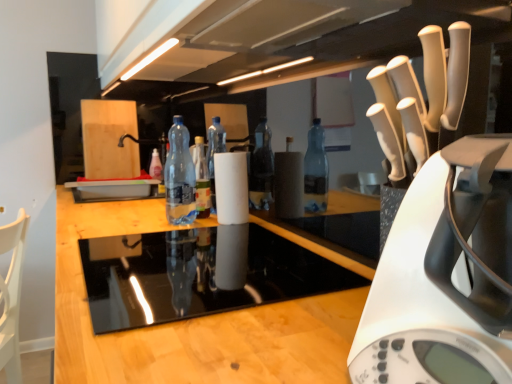
Question: Which direction should I rotate to look at translucent plastic bottle at center, the first bottle viewed from the left, — up or down?

Choices:
 (A) down
 (B) up

Answer: (B)

Question: Is the depth of white plastic kettle at right less than that of transparent plastic bottle at center, the 1th bottle when ordered from front to back?

Choices:
 (A) yes
 (B) no

Answer: (A)

Question: Is white plastic kettle at right not within transparent plastic bottle at center, which is the 1th bottle in right-to-left order?

Choices:
 (A) no
 (B) yes

Answer: (B)

Question: Considering the relative positions of white plastic kettle at right and transparent plastic bottle at center, which is the 1th bottle in right-to-left order, in the image provided, is white plastic kettle at right to the left of transparent plastic bottle at center, which is the 1th bottle in right-to-left order, from the viewer's perspective?

Choices:
 (A) no
 (B) yes

Answer: (A)

Question: Considering the relative positions of white plastic kettle at right and transparent plastic bottle at center, arranged as the second bottle when viewed from the left, in the image provided, is white plastic kettle at right to the right of transparent plastic bottle at center, arranged as the second bottle when viewed from the left, from the viewer's perspective?

Choices:
 (A) no
 (B) yes

Answer: (B)

Question: Is white plastic kettle at right thinner than transparent plastic bottle at center, the 1th bottle when ordered from front to back?

Choices:
 (A) no
 (B) yes

Answer: (A)

Question: Are white plastic kettle at right and transparent plastic bottle at center, arranged as the second bottle when viewed from the left, far apart?

Choices:
 (A) yes
 (B) no

Answer: (B)

Question: From a real-world perspective, is black glass stovetop at center under white plastic kettle at right?

Choices:
 (A) no
 (B) yes

Answer: (B)

Question: Is black glass stovetop at center aimed at white plastic kettle at right?

Choices:
 (A) no
 (B) yes

Answer: (A)

Question: Is black glass stovetop at center bigger than white plastic kettle at right?

Choices:
 (A) yes
 (B) no

Answer: (A)

Question: From a real-world perspective, is black glass stovetop at center located higher than white plastic kettle at right?

Choices:
 (A) no
 (B) yes

Answer: (A)

Question: Considering the relative positions of black glass stovetop at center and white plastic kettle at right in the image provided, is black glass stovetop at center to the left of white plastic kettle at right from the viewer's perspective?

Choices:
 (A) yes
 (B) no

Answer: (A)

Question: Is black glass stovetop at center not close to white plastic kettle at right?

Choices:
 (A) yes
 (B) no

Answer: (B)

Question: Would you consider black glass stovetop at center to be distant from translucent plastic bottle at center, the second bottle when ordered from right to left?

Choices:
 (A) yes
 (B) no

Answer: (A)